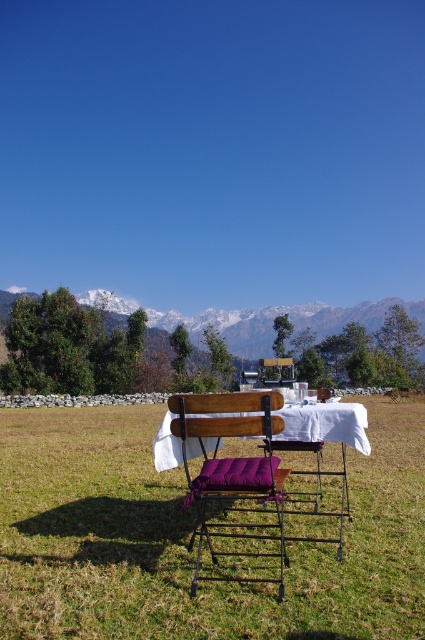
Question: Which point is closer to the camera taking this photo?

Choices:
 (A) (257, 403)
 (B) (271, 362)
 (C) (314, 426)
 (D) (248, 339)

Answer: (A)

Question: Which point is farther to the camera?

Choices:
 (A) (172, 420)
 (B) (119, 516)
 (C) (272, 365)
 (D) (260, 314)

Answer: (D)

Question: Can you confirm if purple fabric table at center is smaller than purple fabric chair at center?

Choices:
 (A) no
 (B) yes

Answer: (B)

Question: Is purple cushioned chair at center bigger than purple fabric table at center?

Choices:
 (A) no
 (B) yes

Answer: (B)

Question: Does snowy mountain range at upper center come behind purple fabric table at center?

Choices:
 (A) yes
 (B) no

Answer: (A)

Question: Among these objects, which one is nearest to the camera?

Choices:
 (A) purple fabric chair at center
 (B) snowy mountain range at upper center
 (C) purple cushioned chair at center
 (D) purple fabric table at center

Answer: (C)